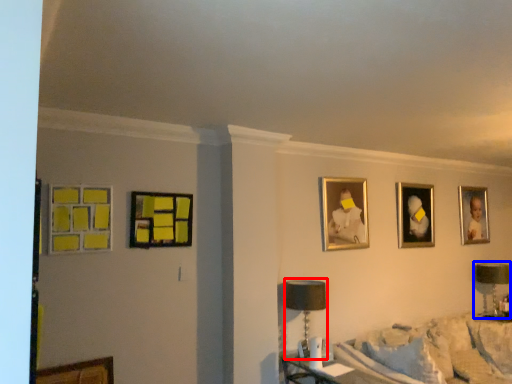
Question: Which object is further to the camera taking this photo, table lamp (highlighted by a red box) or table lamp (highlighted by a blue box)?

Choices:
 (A) table lamp
 (B) table lamp

Answer: (B)